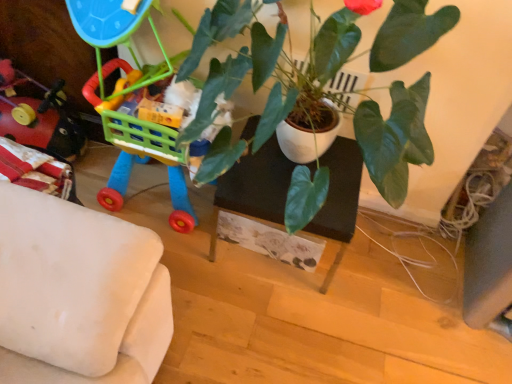
Where is `spots to the right of black matte table at center`? spots to the right of black matte table at center is located at coordinates (375, 280).